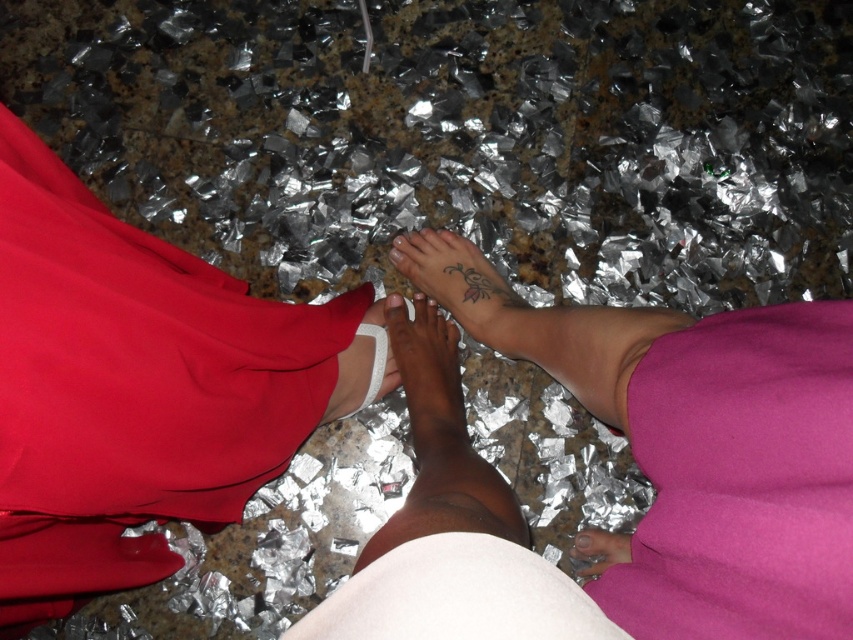
Can you confirm if white fabric at center is bigger than brown matte toe at center?

Correct, white fabric at center is larger in size than brown matte toe at center.

Does white fabric at center have a greater height compared to brown matte toe at center?

Yes.

Does point (357, 339) come in front of point (390, 300)?

Yes, point (357, 339) is closer to viewer.

Find the location of `white fabric at center`. white fabric at center is located at coordinates (361, 371).

Between smooth skin tattoo at center and white fabric at center, which one is positioned higher?

smooth skin tattoo at center is above.

The width and height of the screenshot is (853, 640). Describe the element at coordinates (653, 445) in the screenshot. I see `smooth skin tattoo at center` at that location.

This screenshot has width=853, height=640. What do you see at coordinates (653, 445) in the screenshot?
I see `smooth skin tattoo at center` at bounding box center [653, 445].

This screenshot has width=853, height=640. I want to click on smooth skin tattoo at center, so click(653, 445).

Does smooth skin tattoo at center lie behind matte red dress at left?

No, smooth skin tattoo at center is in front of matte red dress at left.

Who is more distant from viewer, (x=703, y=364) or (x=347, y=316)?

The point (x=347, y=316) is more distant.

The image size is (853, 640). In order to click on smooth skin tattoo at center in this screenshot , I will do `click(653, 445)`.